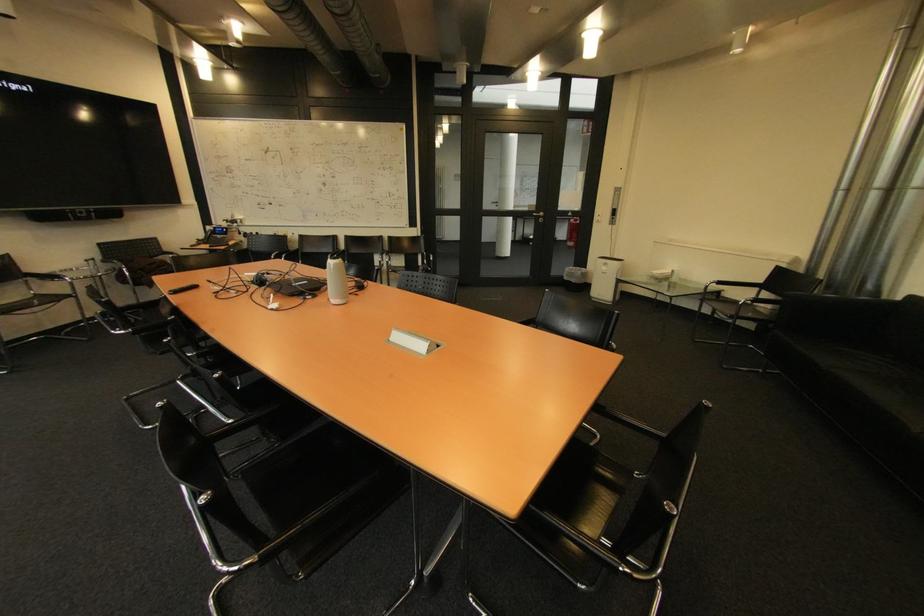
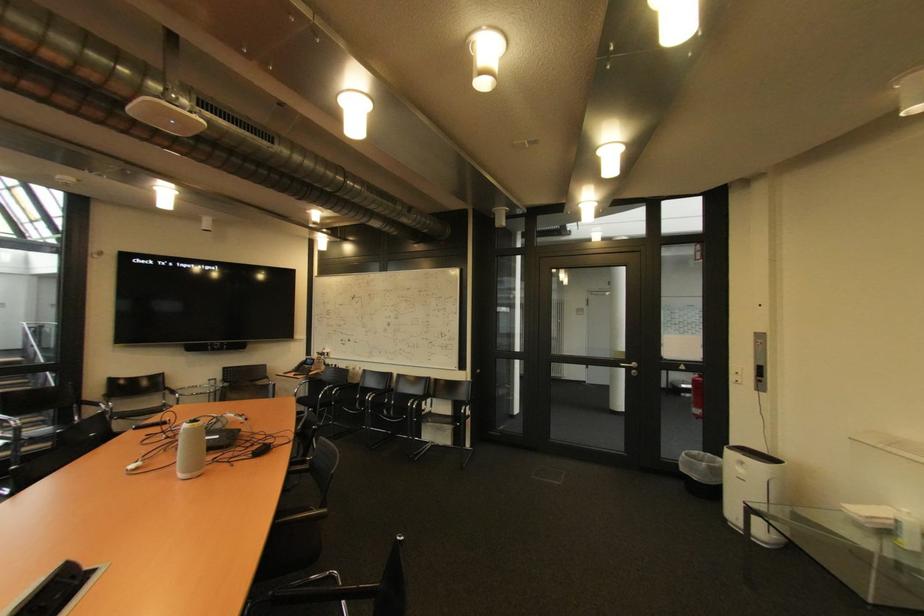
In the second image, find the point that corresponds to pixel 613 270 in the first image.

(748, 471)